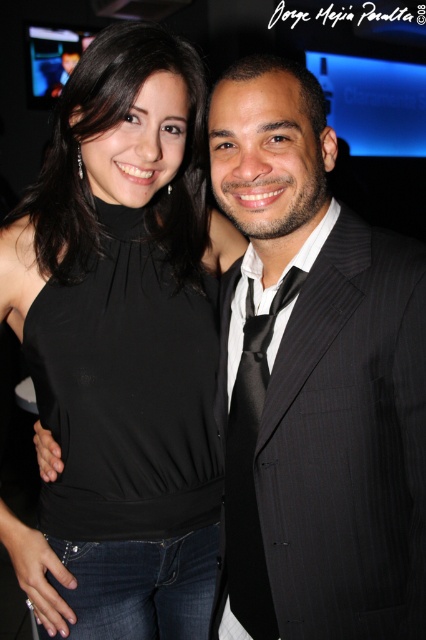
Which is more to the left, black matte top at center or black satin tie at center?

black matte top at center

Who is more distant from viewer, (166, 572) or (247, 556)?

The point (166, 572) is more distant.

Is point (48, 372) less distant than point (250, 380)?

No, (48, 372) is further to viewer.

What are the coordinates of `black matte top at center` in the screenshot? It's located at (120, 348).

Which is below, black pinstripe suit at center or black satin halter top at center?

black pinstripe suit at center is below.

Who is positioned more to the right, black pinstripe suit at center or black satin halter top at center?

From the viewer's perspective, black pinstripe suit at center appears more on the right side.

Is point (348, 620) farther from viewer compared to point (210, 502)?

No.

The height and width of the screenshot is (640, 426). I want to click on black pinstripe suit at center, so click(313, 381).

Does black matte top at center have a larger size compared to black pinstripe suit at center?

Correct, black matte top at center is larger in size than black pinstripe suit at center.

Can you confirm if black matte top at center is positioned to the right of black pinstripe suit at center?

No, black matte top at center is not to the right of black pinstripe suit at center.

Where is `black matte top at center`? This screenshot has height=640, width=426. black matte top at center is located at coordinates (120, 348).